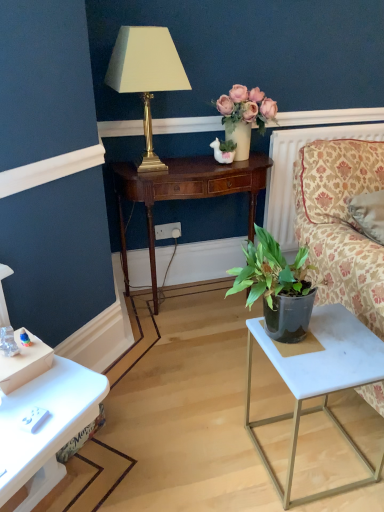
This screenshot has height=512, width=384. I want to click on vacant area on top of white textured radiator at upper right (from a real-world perspective), so click(339, 122).